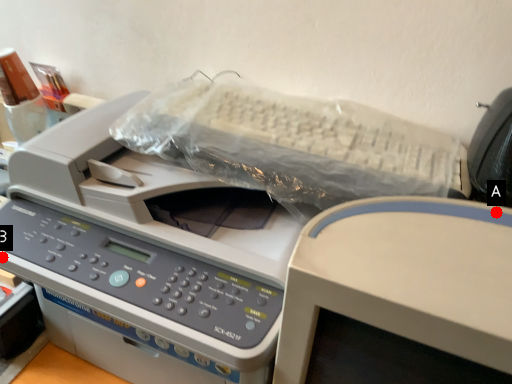
Question: Two points are circled on the image, labeled by A and B beside each circle. Which point is further to the camera?

Choices:
 (A) A is further
 (B) B is further

Answer: (B)